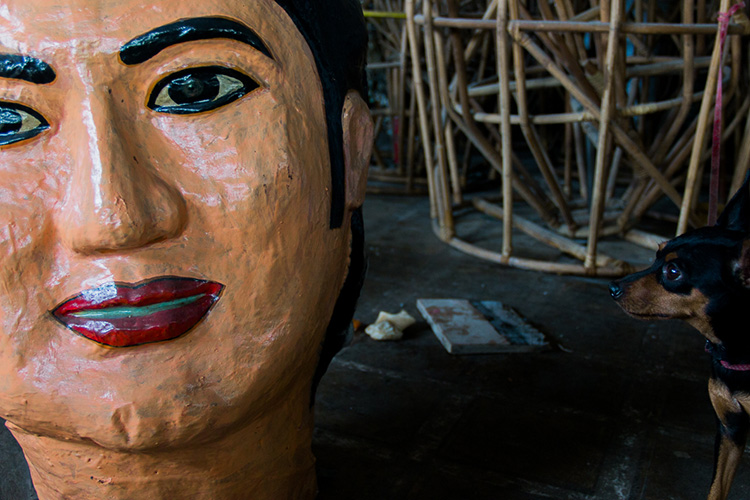
Where is `floor`? This screenshot has width=750, height=500. floor is located at coordinates (445, 433).